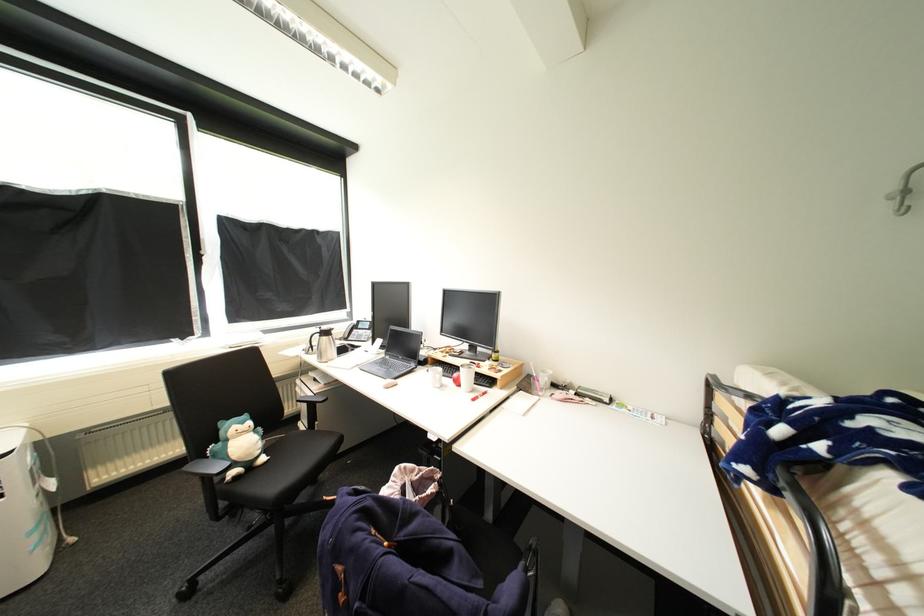
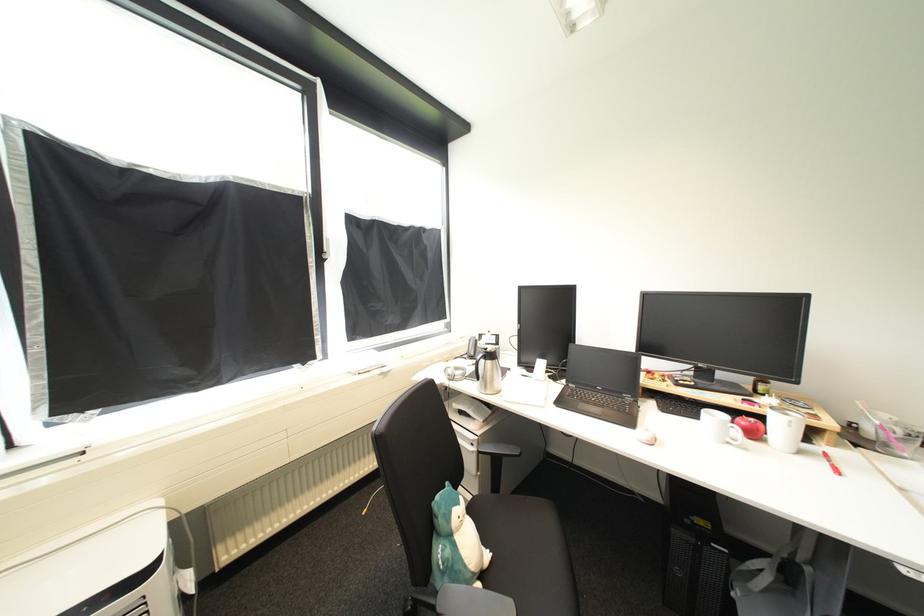
The point at (x=270, y=460) is marked in the first image. Where is the corresponding point in the second image?

(493, 557)